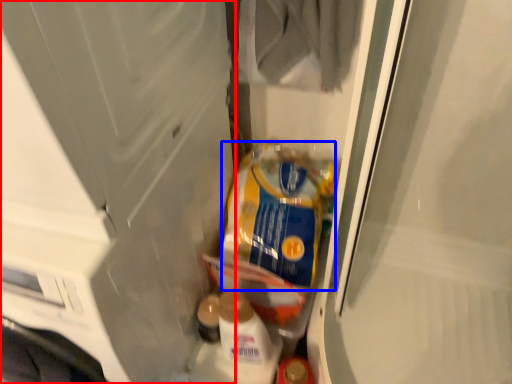
Question: Which object is closer to the camera taking this photo, screen door (highlighted by a red box) or product (highlighted by a blue box)?

Choices:
 (A) screen door
 (B) product

Answer: (A)